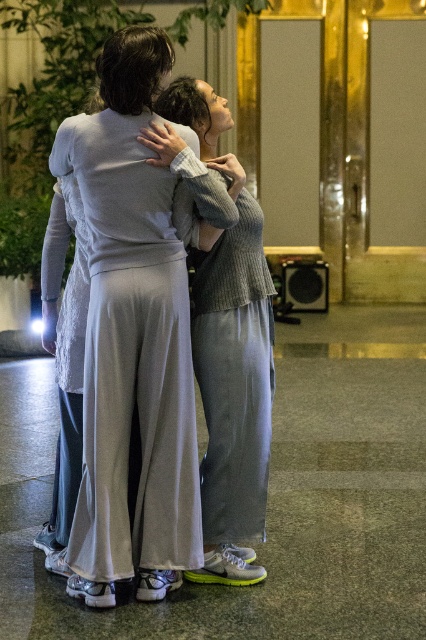
What do you see at coordinates (127, 333) in the screenshot?
I see `light gray knit sweater at center` at bounding box center [127, 333].

Looking at this image, is light gray knit sweater at center positioned in front of knitted gray sweater at center?

That is True.

Is point (169, 285) closer to viewer compared to point (255, 476)?

Yes, point (169, 285) is closer to viewer.

Locate an element on the screen. The image size is (426, 640). light gray knit sweater at center is located at coordinates (127, 333).